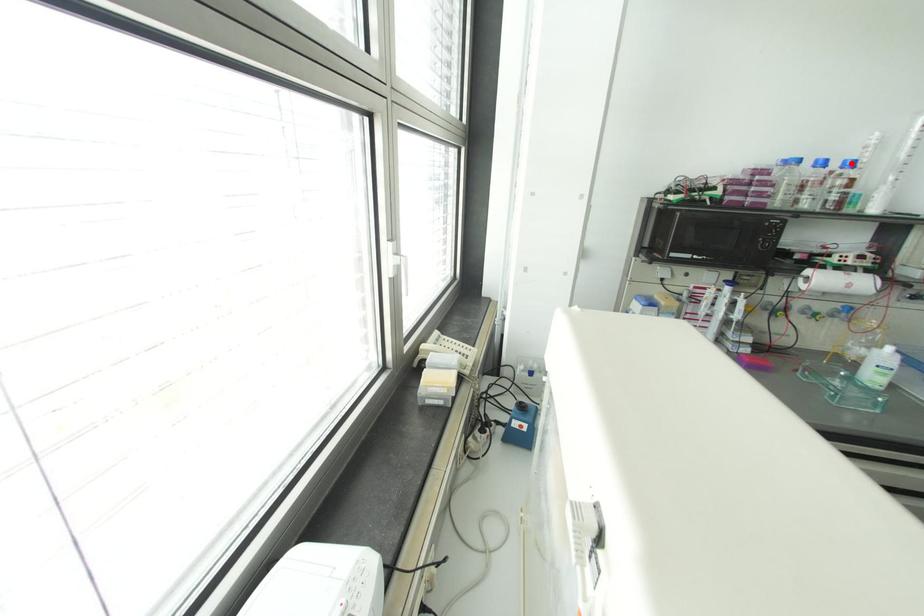
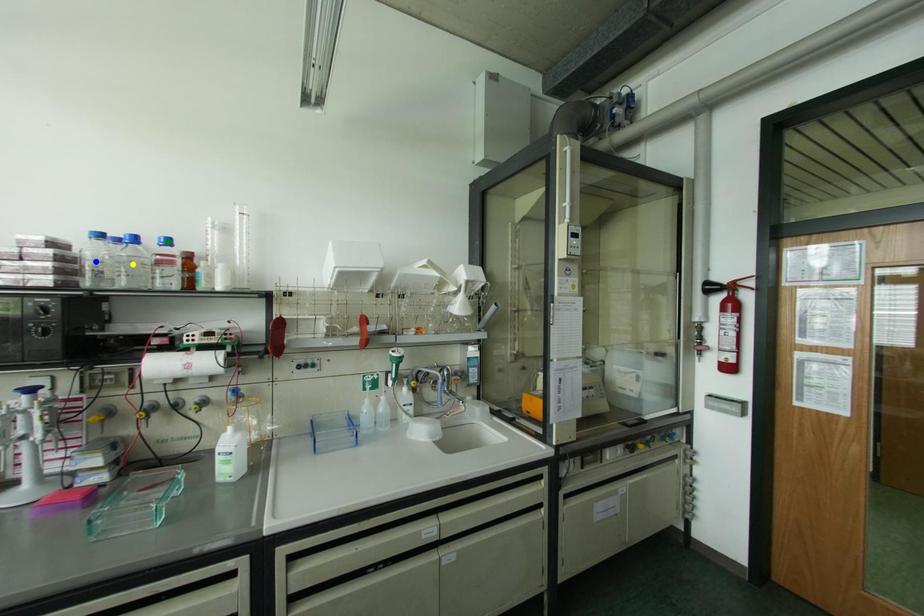
Question: I am providing you with two images of the same scene from different viewpoints. A red point is marked on the first image. You are given multiple points on the second image. In image 2, which mark is for the same physical point as the one in image 1?

Choices:
 (A) green point
 (B) yellow point
 (C) blue point

Answer: (A)